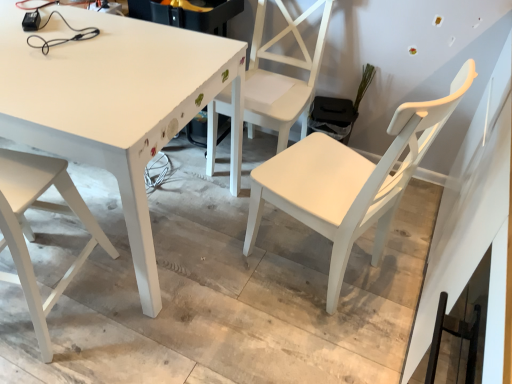
Question: From the image's perspective, is white matte chair at center, which is the 3th chair from left to right, below white matte chair at center, the second chair viewed from the left?

Choices:
 (A) yes
 (B) no

Answer: (A)

Question: From a real-world perspective, does white matte chair at center, which appears as the 1th chair when viewed from the right, stand above white matte chair at center, arranged as the second chair when viewed from the right?

Choices:
 (A) yes
 (B) no

Answer: (A)

Question: Is white matte chair at center, which appears as the 1th chair when viewed from the right, far from white matte chair at center, the second chair viewed from the left?

Choices:
 (A) no
 (B) yes

Answer: (A)

Question: Does white matte chair at center, which is the 3th chair from left to right, contain white matte chair at center, the second chair viewed from the left?

Choices:
 (A) yes
 (B) no

Answer: (B)

Question: Is white matte chair at center, which appears as the 1th chair when viewed from the right, taller than white matte chair at center, arranged as the second chair when viewed from the right?

Choices:
 (A) yes
 (B) no

Answer: (B)

Question: In the image, is white matte chair at center, which is the 3th chair from left to right, positioned in front of or behind white matte chair at lower left, placed as the third chair when sorted from right to left?

Choices:
 (A) front
 (B) behind

Answer: (B)

Question: Is point click(342, 268) closer or farther from the camera than point click(7, 213)?

Choices:
 (A) farther
 (B) closer

Answer: (A)

Question: From the image's perspective, is white matte chair at center, which is the 3th chair from left to right, positioned above or below white matte chair at lower left, placed as the third chair when sorted from right to left?

Choices:
 (A) above
 (B) below

Answer: (A)

Question: Choose the correct answer: Is white matte chair at center, which is the 3th chair from left to right, inside white matte chair at lower left, marked as the first chair in a left-to-right arrangement, or outside it?

Choices:
 (A) inside
 (B) outside

Answer: (B)

Question: From a real-world perspective, is white matte chair at lower left, placed as the third chair when sorted from right to left, physically located above or below white matte chair at center, arranged as the second chair when viewed from the right?

Choices:
 (A) below
 (B) above

Answer: (A)

Question: From the image's perspective, is white matte chair at lower left, placed as the third chair when sorted from right to left, positioned above or below white matte chair at center, arranged as the second chair when viewed from the right?

Choices:
 (A) below
 (B) above

Answer: (A)

Question: Considering the positions of white matte chair at lower left, marked as the first chair in a left-to-right arrangement, and white matte chair at center, arranged as the second chair when viewed from the right, in the image, is white matte chair at lower left, marked as the first chair in a left-to-right arrangement, bigger or smaller than white matte chair at center, arranged as the second chair when viewed from the right,?

Choices:
 (A) small
 (B) big

Answer: (A)

Question: Does point (13, 213) appear closer or farther from the camera than point (260, 3)?

Choices:
 (A) closer
 (B) farther

Answer: (A)

Question: Relative to white painted wood table at center, is white matte chair at lower left, marked as the first chair in a left-to-right arrangement, in front or behind?

Choices:
 (A) behind
 (B) front

Answer: (B)

Question: Is white matte chair at lower left, marked as the first chair in a left-to-right arrangement, inside or outside of white painted wood table at center?

Choices:
 (A) outside
 (B) inside

Answer: (B)